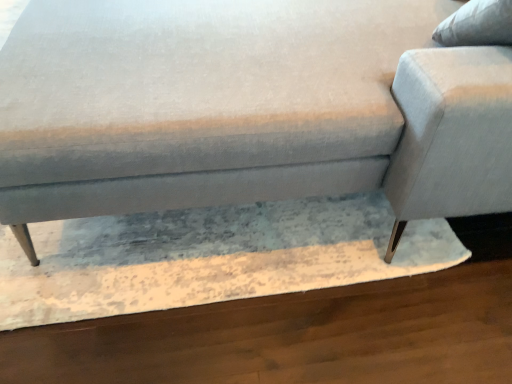
Question: In terms of width, does light gray fabric swivel chair at upper right look wider or thinner when compared to textured fabric couch at center?

Choices:
 (A) thin
 (B) wide

Answer: (A)

Question: Considering the positions of point (504, 19) and point (153, 145), is point (504, 19) closer or farther from the camera than point (153, 145)?

Choices:
 (A) farther
 (B) closer

Answer: (A)

Question: Choose the correct answer: Is light gray fabric swivel chair at upper right inside textured fabric couch at center or outside it?

Choices:
 (A) outside
 (B) inside

Answer: (B)

Question: From the image's perspective, is textured fabric couch at center above or below light gray fabric swivel chair at upper right?

Choices:
 (A) below
 (B) above

Answer: (B)

Question: Based on their positions, is textured fabric couch at center located to the left or right of light gray fabric swivel chair at upper right?

Choices:
 (A) right
 (B) left

Answer: (B)

Question: Considering their positions, is textured fabric couch at center located in front of or behind light gray fabric swivel chair at upper right?

Choices:
 (A) front
 (B) behind

Answer: (A)

Question: Considering the positions of textured fabric couch at center and light gray fabric swivel chair at upper right in the image, is textured fabric couch at center taller or shorter than light gray fabric swivel chair at upper right?

Choices:
 (A) tall
 (B) short

Answer: (A)